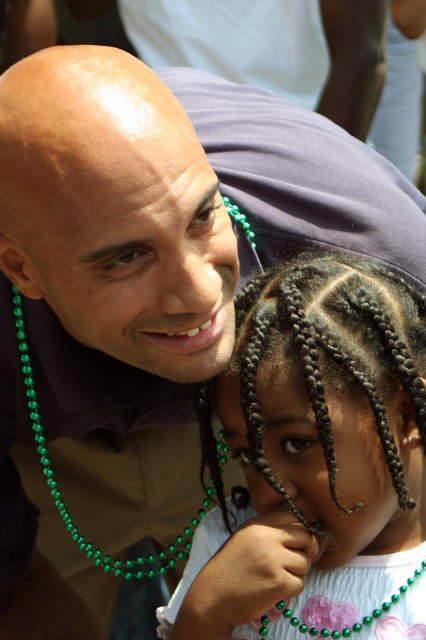
Based on the scene described, where is the dark brown braided hair at center in relation to the green pearl necklace at lower center?

The dark brown braided hair at center is above the green pearl necklace at lower center.

Looking at this image, you are an app user trying to identify which necklace is on the left side between the green beaded necklace at left and the green pearl necklace at lower center. Based on the scene, which one is positioned more to the left?

The green beaded necklace at left is positioned more to the left than the green pearl necklace at lower center.